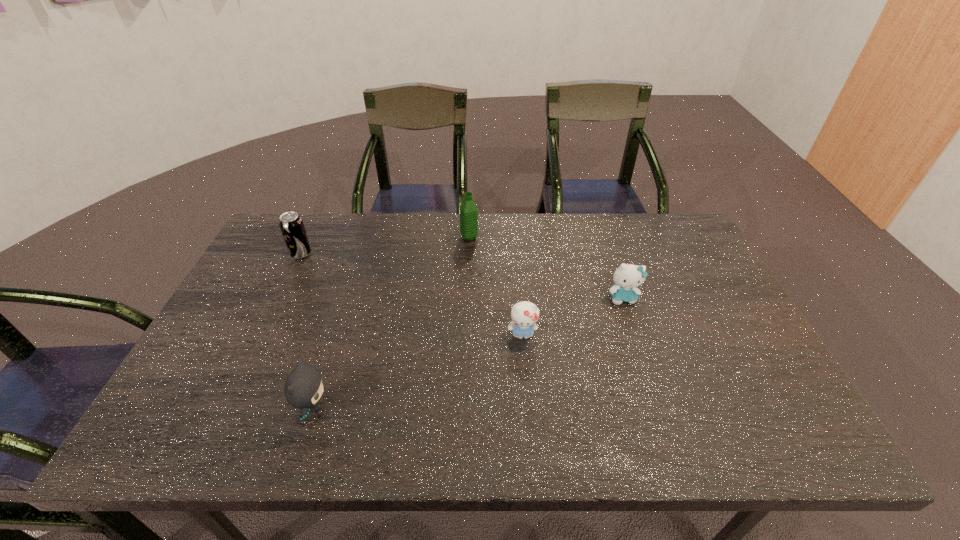
The height and width of the screenshot is (540, 960). I want to click on blank space located 0.290m on the front of the farthest object, so click(x=468, y=307).

Locate an element on the screen. The height and width of the screenshot is (540, 960). vacant point located 0.340m on the front of the second farthest object is located at coordinates (257, 347).

This screenshot has width=960, height=540. I want to click on vacant area located 0.150m on the front-facing side of the leftmost kitten, so click(x=398, y=409).

The image size is (960, 540). I want to click on vacant point located on the face of the rightmost kitten, so click(x=651, y=380).

You are a GUI agent. You are given a task and a screenshot of the screen. Output one action in this format:
    pyautogui.click(x=<x>, y=<y>)
    Task: Click on the free space located 0.210m on the front-facing side of the second nearest kitten
    This screenshot has width=960, height=540.
    Given the screenshot: What is the action you would take?
    pyautogui.click(x=530, y=420)

The height and width of the screenshot is (540, 960). I want to click on water bottle positioned at the far edge, so click(468, 210).

Where is `soda can that is at the far edge`? The width and height of the screenshot is (960, 540). soda can that is at the far edge is located at coordinates (291, 225).

Where is `object present at the near edge`? This screenshot has width=960, height=540. object present at the near edge is located at coordinates (303, 388).

Image resolution: width=960 pixels, height=540 pixels. What are the coordinates of `object present at the left edge` in the screenshot? It's located at (291, 225).

This screenshot has width=960, height=540. Identify the location of object that is positioned at the far left corner. point(291,225).